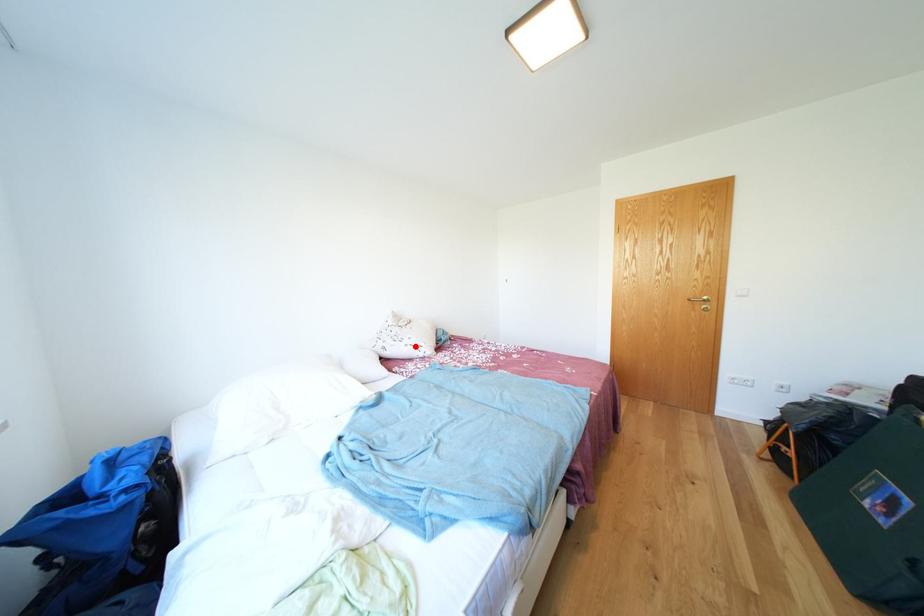
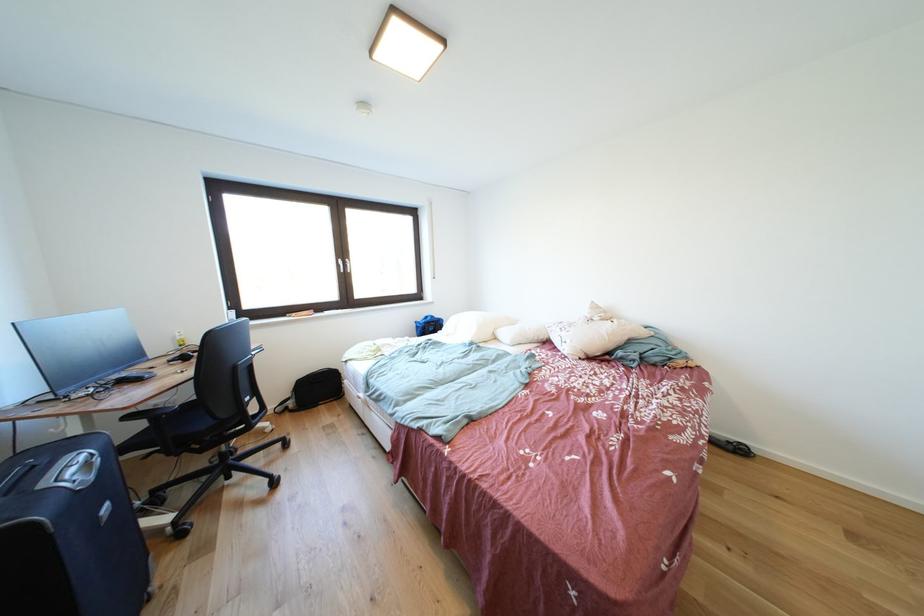
Locate, in the second image, the point that corresponds to the highlighted location in the first image.

(572, 338)